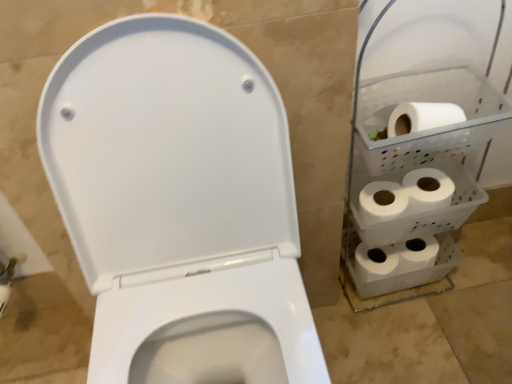
Question: Considering the positions of white matte toilet paper at lower right, which is the 3th toilet paper from right to left, and white matte toilet paper at right, which is the first toilet paper in right-to-left order, in the image, is white matte toilet paper at lower right, which is the 3th toilet paper from right to left, taller or shorter than white matte toilet paper at right, which is the first toilet paper in right-to-left order,?

Choices:
 (A) tall
 (B) short

Answer: (A)

Question: Considering the relative positions of white matte toilet paper at lower right, positioned as the 2th toilet paper in left-to-right order, and white matte toilet paper at right, which is the fourth toilet paper in left-to-right order, in the image provided, is white matte toilet paper at lower right, positioned as the 2th toilet paper in left-to-right order, to the left or to the right of white matte toilet paper at right, which is the fourth toilet paper in left-to-right order,?

Choices:
 (A) left
 (B) right

Answer: (A)

Question: Which object is positioned closest to the white plastic shelf at right?

Choices:
 (A) white matte toilet paper at right, which is counted as the fourth toilet paper, starting from the right
 (B) white matte toilet paper at lower right, which is the 3th toilet paper from right to left
 (C) white matte toilet paper at right, which ranks as the 3th toilet paper in left-to-right order
 (D) white matte toilet paper at right, which is the first toilet paper in right-to-left order

Answer: (D)

Question: Considering the real-world distances, which object is closest to the white plastic shelf at right?

Choices:
 (A) white matte toilet paper at right, which is counted as the fourth toilet paper, starting from the right
 (B) white matte toilet paper at right, which is the fourth toilet paper in left-to-right order
 (C) white matte toilet paper at right, which ranks as the 2th toilet paper in right-to-left order
 (D) white matte toilet paper at lower right, which is the 3th toilet paper from right to left

Answer: (B)